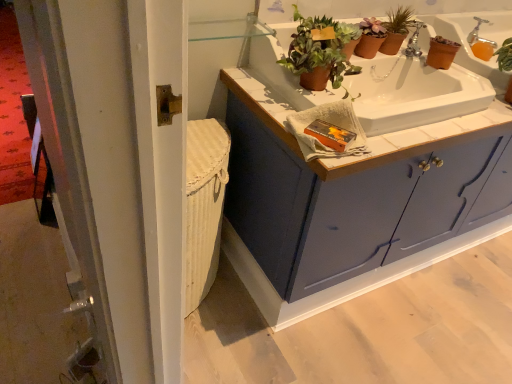
Question: From the image's perspective, is matte blue cabinet at center located beneath silver metallic faucet at upper right?

Choices:
 (A) yes
 (B) no

Answer: (A)

Question: Can you confirm if matte blue cabinet at center is bigger than silver metallic faucet at upper right?

Choices:
 (A) yes
 (B) no

Answer: (A)

Question: Are matte blue cabinet at center and silver metallic faucet at upper right making contact?

Choices:
 (A) no
 (B) yes

Answer: (A)

Question: Is silver metallic faucet at upper right completely or partially inside matte blue cabinet at center?

Choices:
 (A) yes
 (B) no

Answer: (B)

Question: From the image's perspective, is matte blue cabinet at center on top of silver metallic faucet at upper right?

Choices:
 (A) yes
 (B) no

Answer: (B)

Question: Is matte blue cabinet at center further to the viewer compared to silver metallic faucet at upper right?

Choices:
 (A) yes
 (B) no

Answer: (B)

Question: Is silver metallic faucet at upper right next to terracotta clay pot at upper center, arranged as the 1th houseplant when viewed from the front, and touching it?

Choices:
 (A) no
 (B) yes

Answer: (A)

Question: Is silver metallic faucet at upper right smaller than terracotta clay pot at upper center, arranged as the 1th houseplant when viewed from the front?

Choices:
 (A) no
 (B) yes

Answer: (B)

Question: Does silver metallic faucet at upper right have a greater width compared to terracotta clay pot at upper center, which appears as the first houseplant when viewed from the left?

Choices:
 (A) no
 (B) yes

Answer: (A)

Question: From a real-world perspective, does silver metallic faucet at upper right stand above terracotta clay pot at upper center, which appears as the first houseplant when viewed from the left?

Choices:
 (A) no
 (B) yes

Answer: (A)

Question: From a real-world perspective, is silver metallic faucet at upper right physically below terracotta clay pot at upper center, arranged as the 1th houseplant when viewed from the front?

Choices:
 (A) yes
 (B) no

Answer: (A)

Question: Considering the relative positions of silver metallic faucet at upper right and terracotta clay pot at upper center, arranged as the 1th houseplant when viewed from the front, in the image provided, is silver metallic faucet at upper right to the left of terracotta clay pot at upper center, arranged as the 1th houseplant when viewed from the front, from the viewer's perspective?

Choices:
 (A) no
 (B) yes

Answer: (A)

Question: Considering the relative sizes of white tile countertop at upper center and silver metallic faucet at upper right in the image provided, is white tile countertop at upper center thinner than silver metallic faucet at upper right?

Choices:
 (A) no
 (B) yes

Answer: (A)